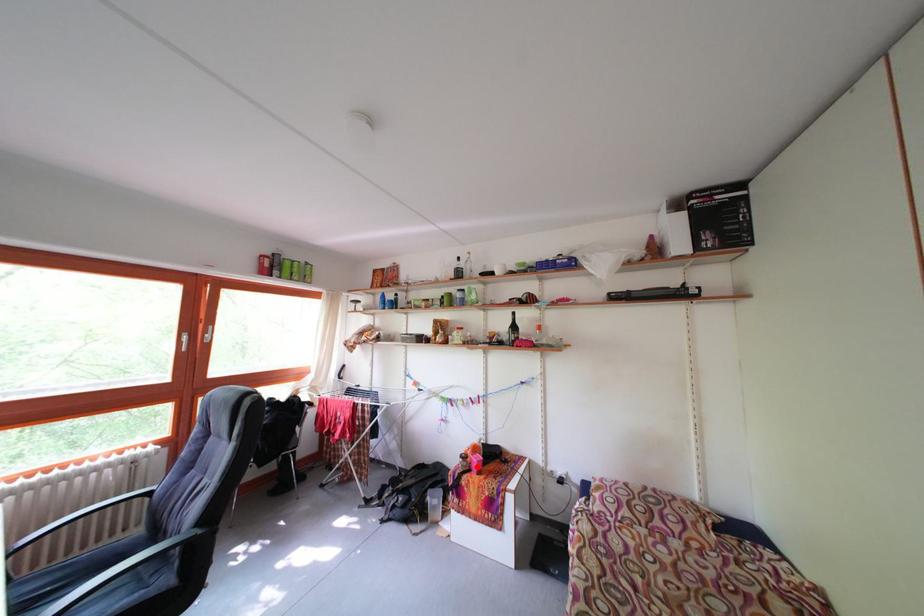
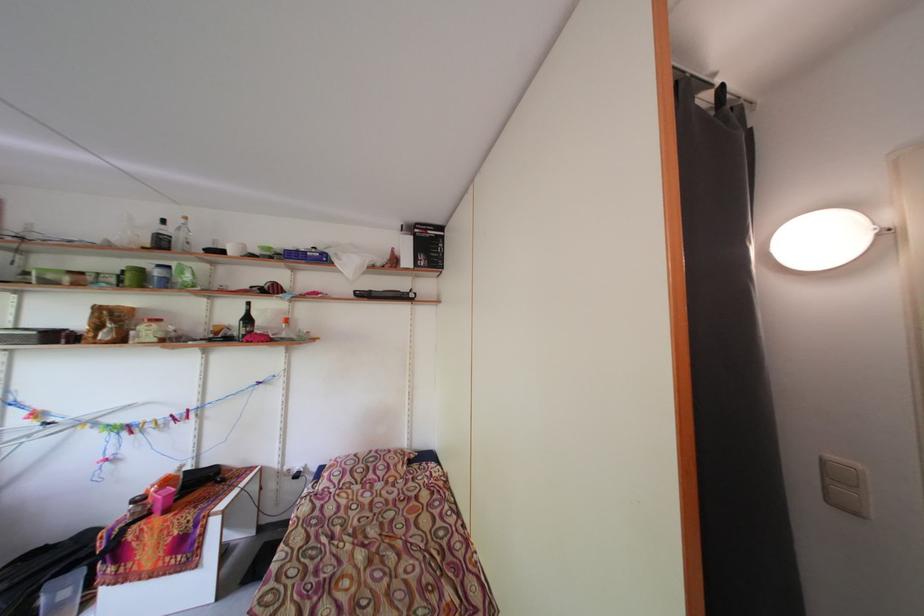
Question: I am providing you with two images of the same scene from different viewpoints. A red point is shown in image1. For the corresponding object point in image2, is it positioned nearer or farther from the camera?

Choices:
 (A) Nearer
 (B) Farther

Answer: (A)